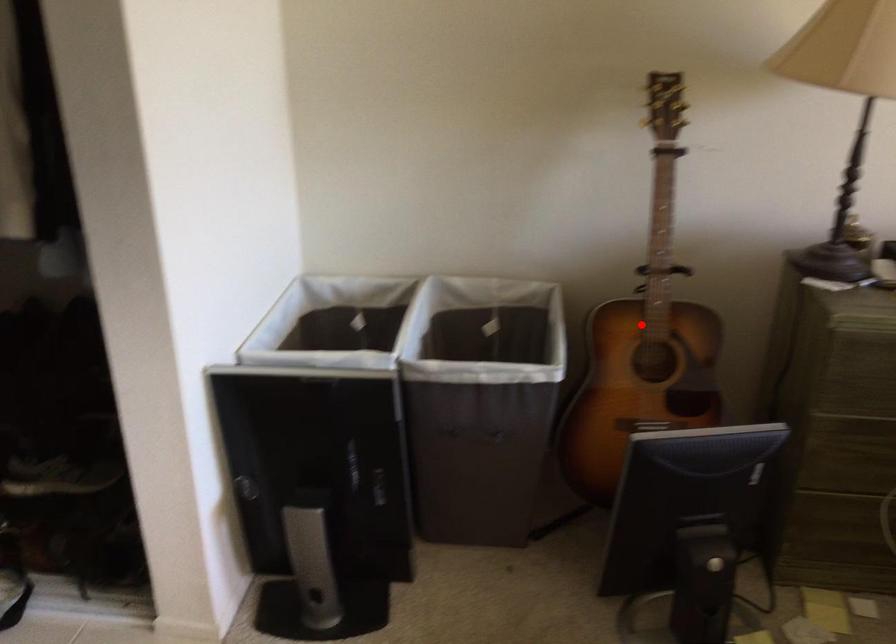
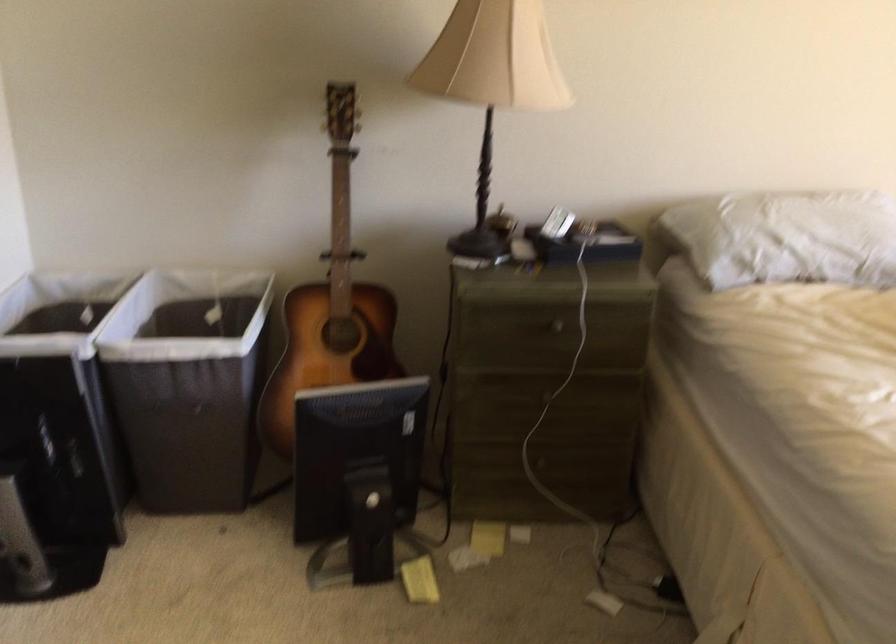
The point at the highlighted location is marked in the first image. Where is the corresponding point in the second image?

(331, 303)